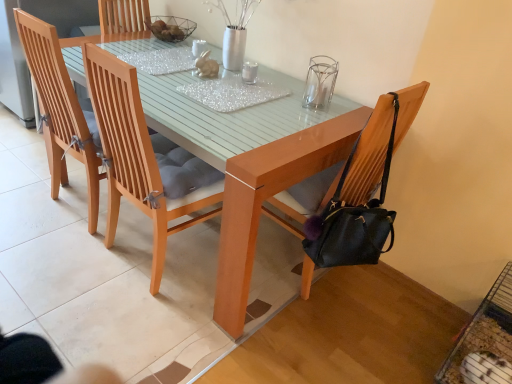
Question: Is black leather chair at right, which appears as the fourth chair when viewed from the left, completely or partially outside of light brown wooden chair at center, which is counted as the third chair, starting from the left?

Choices:
 (A) no
 (B) yes

Answer: (A)

Question: Considering the relative positions of black leather chair at right, placed as the first chair when sorted from right to left, and light brown wooden chair at center, which is counted as the third chair, starting from the left, in the image provided, is black leather chair at right, placed as the first chair when sorted from right to left, behind light brown wooden chair at center, which is counted as the third chair, starting from the left,?

Choices:
 (A) no
 (B) yes

Answer: (B)

Question: Can you confirm if black leather chair at right, which appears as the fourth chair when viewed from the left, is positioned to the left of light brown wooden chair at center, arranged as the 2th chair when viewed from the right?

Choices:
 (A) no
 (B) yes

Answer: (A)

Question: Is black leather chair at right, which appears as the fourth chair when viewed from the left, surrounding light brown wooden chair at center, arranged as the 2th chair when viewed from the right?

Choices:
 (A) no
 (B) yes

Answer: (A)

Question: Can you confirm if black leather chair at right, placed as the first chair when sorted from right to left, is positioned to the right of light brown wooden chair at center, which is counted as the third chair, starting from the left?

Choices:
 (A) no
 (B) yes

Answer: (B)

Question: Looking at their shapes, would you say wooden chair at center, positioned as the second chair in left-to-right order, is wider or thinner than transparent glass candle holder at upper center?

Choices:
 (A) thin
 (B) wide

Answer: (B)

Question: Is wooden chair at center, positioned as the second chair in left-to-right order, spatially inside transparent glass candle holder at upper center, or outside of it?

Choices:
 (A) outside
 (B) inside

Answer: (A)

Question: Is wooden chair at center, positioned as the second chair in left-to-right order, in front of or behind transparent glass candle holder at upper center in the image?

Choices:
 (A) behind
 (B) front

Answer: (B)

Question: From a real-world perspective, relative to transparent glass candle holder at upper center, is wooden chair at center, arranged as the third chair when viewed from the right, vertically above or below?

Choices:
 (A) below
 (B) above

Answer: (A)

Question: From a real-world perspective, relative to light brown wooden chair at center, arranged as the 2th chair when viewed from the right, is wooden chair at center, positioned as the second chair in left-to-right order, vertically above or below?

Choices:
 (A) below
 (B) above

Answer: (B)

Question: Is wooden chair at center, positioned as the second chair in left-to-right order, situated inside light brown wooden chair at center, arranged as the 2th chair when viewed from the right, or outside?

Choices:
 (A) outside
 (B) inside

Answer: (B)

Question: Is wooden chair at center, positioned as the second chair in left-to-right order, wider or thinner than light brown wooden chair at center, arranged as the 2th chair when viewed from the right?

Choices:
 (A) thin
 (B) wide

Answer: (A)

Question: Is wooden chair at center, arranged as the third chair when viewed from the right, taller or shorter than light brown wooden chair at center, arranged as the 2th chair when viewed from the right?

Choices:
 (A) tall
 (B) short

Answer: (A)

Question: Is point (233, 173) positioned closer to the camera than point (242, 215)?

Choices:
 (A) farther
 (B) closer

Answer: (B)

Question: Considering their positions, is light brown wooden chair at center, which is counted as the third chair, starting from the left, located in front of or behind black leather chair at right, which appears as the fourth chair when viewed from the left?

Choices:
 (A) front
 (B) behind

Answer: (A)